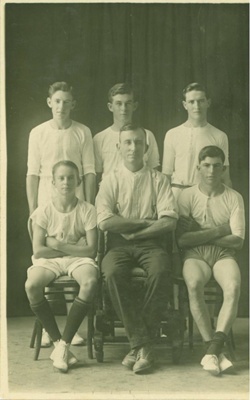
You are a GUI agent. You are given a task and a screenshot of the screen. Output one action in this format:
    pyautogui.click(x=<x>, y=<y>)
    Task: Click on the stocking
    The width and height of the screenshot is (250, 400).
    Given the screenshot: What is the action you would take?
    pyautogui.click(x=77, y=320), pyautogui.click(x=44, y=320), pyautogui.click(x=217, y=344), pyautogui.click(x=208, y=344)